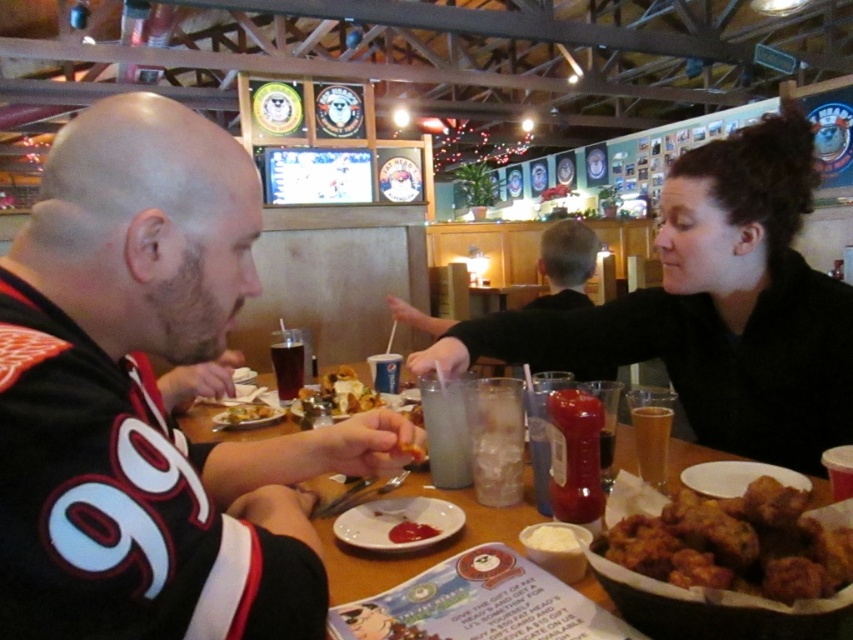
Can you confirm if black matte jacket at upper right is positioned above yellow fried chicken at center?

Yes, black matte jacket at upper right is above yellow fried chicken at center.

Consider the image. Does black matte jacket at upper right have a smaller size compared to yellow fried chicken at center?

Incorrect, black matte jacket at upper right is not smaller in size than yellow fried chicken at center.

Is point (787, 346) more distant than point (221, 419)?

No, it is not.

Identify the location of black matte jacket at upper right. The height and width of the screenshot is (640, 853). (714, 307).

Is translucent glass beer at table center behind golden crispy chicken at center?

That is False.

Does translucent glass beer at table center have a lesser height compared to golden crispy chicken at center?

Incorrect, translucent glass beer at table center's height does not fall short of golden crispy chicken at center's.

Image resolution: width=853 pixels, height=640 pixels. In order to click on translucent glass beer at table center in this screenshot , I will do `click(653, 442)`.

Who is more forward, (32, 589) or (654, 456)?

Point (32, 589) is more forward.

Between black jersey at center and translucent glass beer at table center, which one appears on the left side from the viewer's perspective?

Positioned to the left is black jersey at center.

Is point (100, 136) less distant than point (659, 424)?

Yes, it is in front of point (659, 424).

You are a GUI agent. You are given a task and a screenshot of the screen. Output one action in this format:
    pyautogui.click(x=<x>, y=<y>)
    Task: Click on the black jersey at center
    
    Given the screenshot: What is the action you would take?
    pyautogui.click(x=149, y=401)